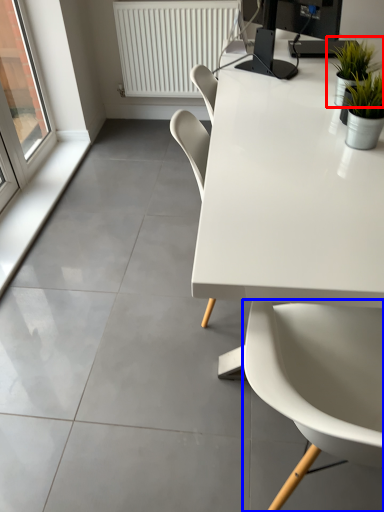
Question: Which object appears farthest to the camera in this image, houseplant (highlighted by a red box) or chair (highlighted by a blue box)?

Choices:
 (A) houseplant
 (B) chair

Answer: (A)